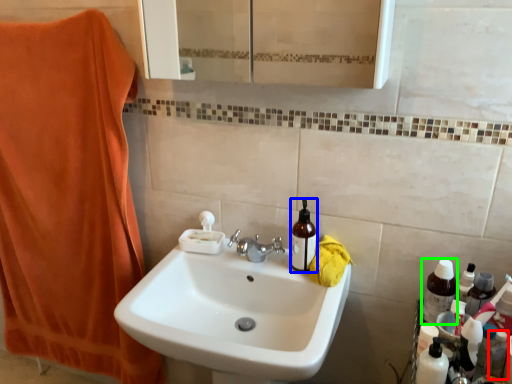
Question: Estimate the real-world distances between objects in this image. Which object is farther from toiletry (highlighted by a red box), bottle (highlighted by a blue box) or bottle (highlighted by a green box)?

Choices:
 (A) bottle
 (B) bottle

Answer: (A)